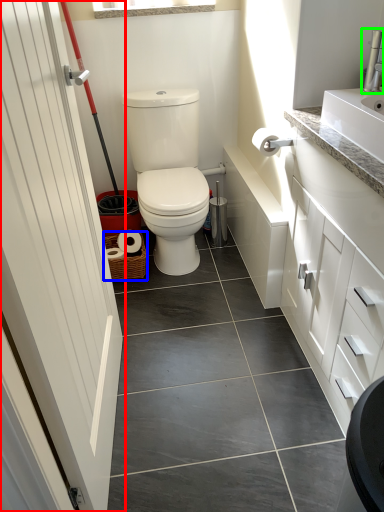
Question: Estimate the real-world distances between objects in this image. Which object is closer to door (highlighted by a red box), basket (highlighted by a blue box) or faucet (highlighted by a green box)?

Choices:
 (A) basket
 (B) faucet

Answer: (A)